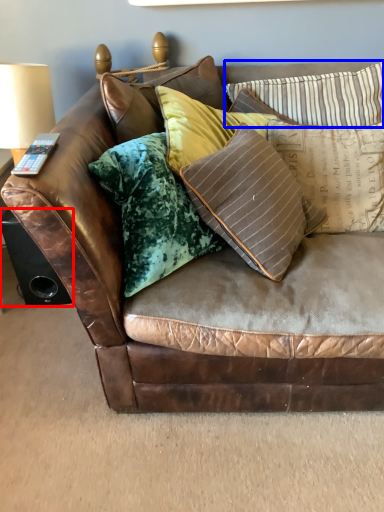
Question: Which point is closer to the camera, speaker (highlighted by a red box) or pillow (highlighted by a blue box)?

Choices:
 (A) speaker
 (B) pillow

Answer: (B)